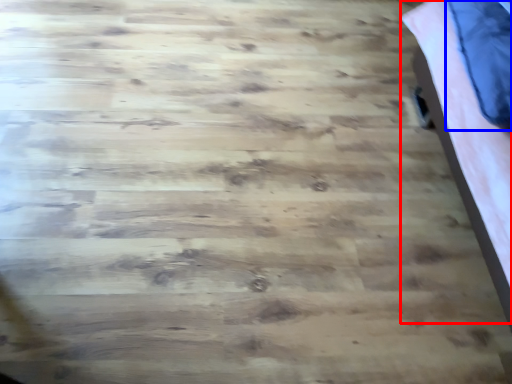
Question: Which of the following is the closest to the observer, bed (highlighted by a red box) or pillow (highlighted by a blue box)?

Choices:
 (A) bed
 (B) pillow

Answer: (A)